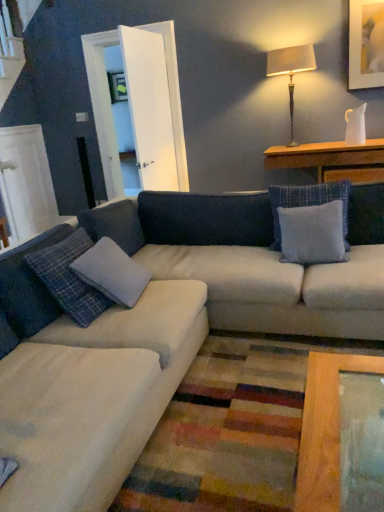
Question: Looking at the image, does gray fabric pillow at center, which is the second pillow in left-to-right order, seem bigger or smaller compared to plaid fabric pillow at lower left, arranged as the second pillow when viewed from the right?

Choices:
 (A) small
 (B) big

Answer: (A)

Question: Would you say gray fabric pillow at center, which is the second pillow in left-to-right order, is to the left or to the right of plaid fabric pillow at lower left, the 1th pillow positioned from the left, in the picture?

Choices:
 (A) left
 (B) right

Answer: (B)

Question: Based on their relative distances, which object is farther from the plaid fabric pillow at lower left, the 1th pillow positioned from the left?

Choices:
 (A) gray fabric pillow at center, marked as the first pillow in a right-to-left arrangement
 (B) wooden table at upper right
 (C) matte gold picture frame at upper right
 (D) metallic gold table lamp at upper right
 (E) white fabric couch at center

Answer: (C)

Question: Which of these objects is positioned closest to the plaid fabric pillow at lower left, the 1th pillow positioned from the left?

Choices:
 (A) gray fabric pillow at center, marked as the first pillow in a right-to-left arrangement
 (B) metallic gold table lamp at upper right
 (C) wooden table at upper right
 (D) matte gold picture frame at upper right
 (E) white fabric couch at center

Answer: (E)